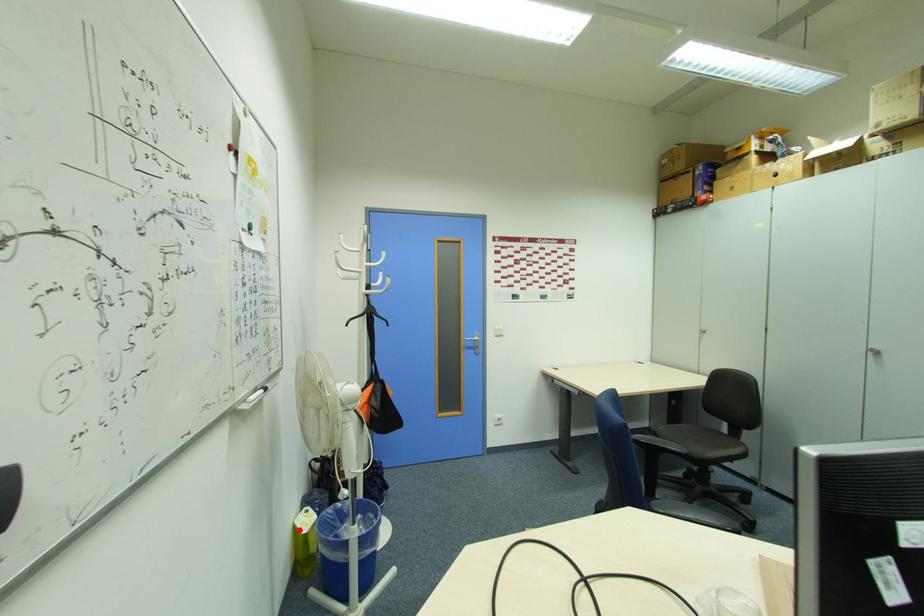
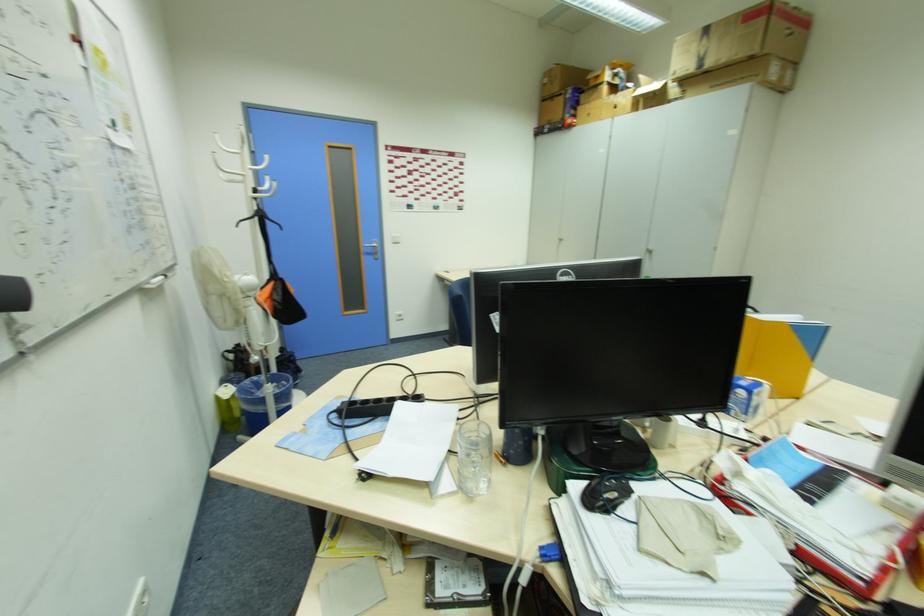
In the second image, find the point that corresponds to the highlighted location in the first image.

(220, 400)